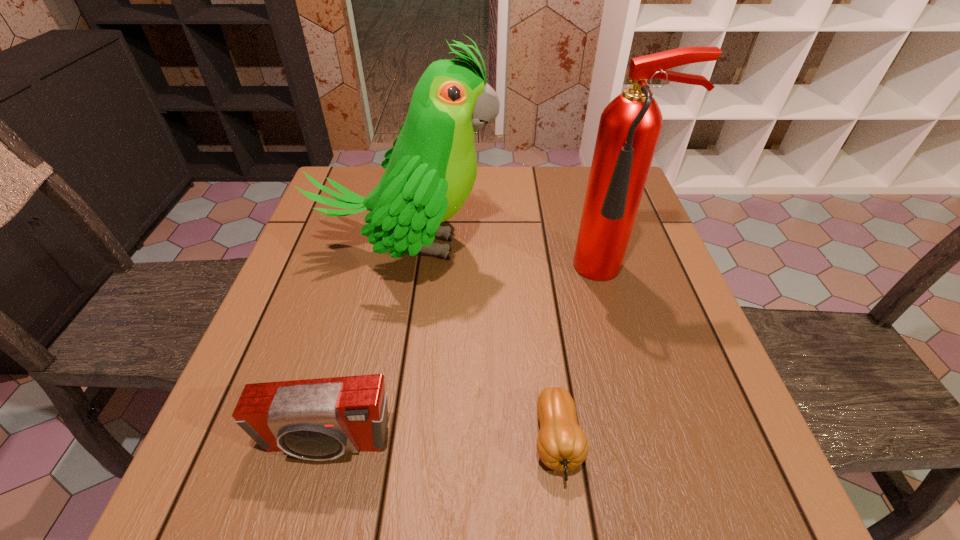
Where is `object identified as the second closest to the parakeet`? object identified as the second closest to the parakeet is located at coordinates (562, 445).

Identify which object is located as the third nearest to the rightmost object. Please provide its 2D coordinates. Your answer should be formatted as a tuple, i.e. [(x, y)], where the tuple contains the x and y coordinates of a point satisfying the conditions above.

[(321, 419)]

You are a GUI agent. You are given a task and a screenshot of the screen. Output one action in this format:
    pyautogui.click(x=<x>, y=<y>)
    Task: Click on the blank area in the image that satisfies the following two spatial constraints: 1. on the beak of the parakeet; 2. on the front-facing side of the second shortest object
    This screenshot has height=540, width=960.
    Given the screenshot: What is the action you would take?
    pyautogui.click(x=372, y=444)

This screenshot has width=960, height=540. I want to click on vacant space that satisfies the following two spatial constraints: 1. on the beak of the parakeet; 2. on the front-facing side of the second shortest object, so click(x=372, y=444).